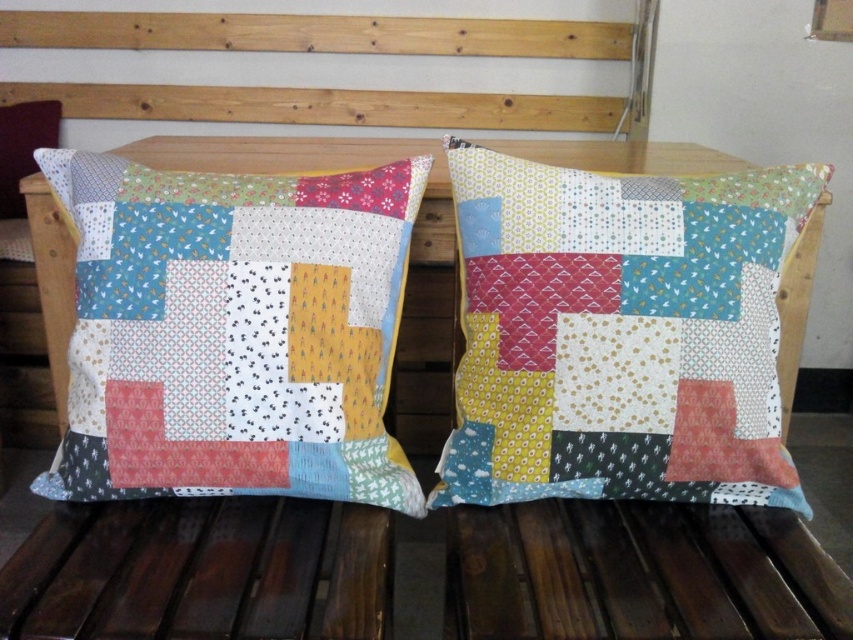
Question: Where is patchwork fabric pillow at center located in relation to patchwork fabric pillow at left in the image?

Choices:
 (A) above
 (B) below

Answer: (B)

Question: In this image, where is patchwork fabric pillow at center located relative to patchwork fabric pillow at left?

Choices:
 (A) below
 (B) above

Answer: (A)

Question: Is patchwork fabric pillow at center to the left of patchwork fabric pillow at left from the viewer's perspective?

Choices:
 (A) yes
 (B) no

Answer: (B)